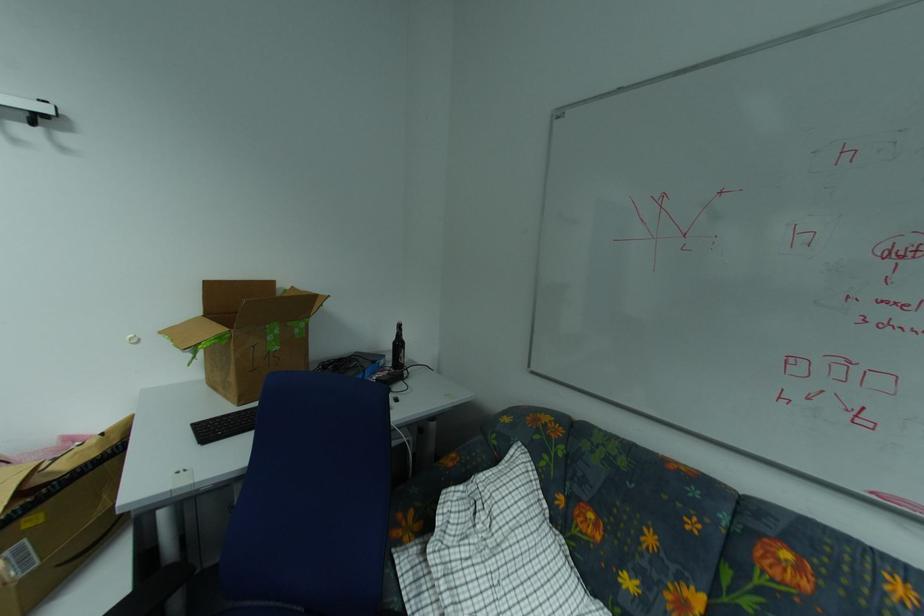
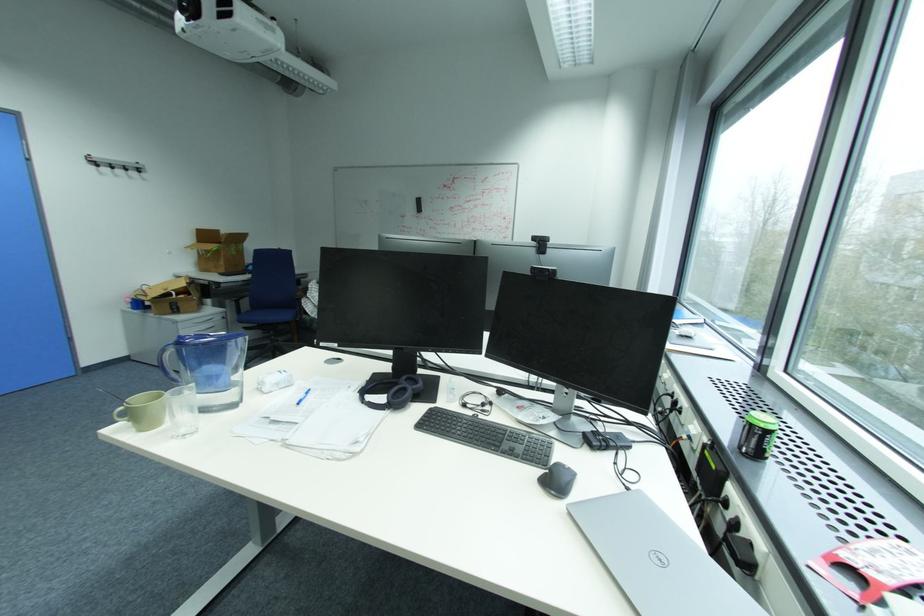
Question: What movement of the cameraman would produce the second image?

Choices:
 (A) Left
 (B) Right
 (C) Forward
 (D) Backward

Answer: (D)